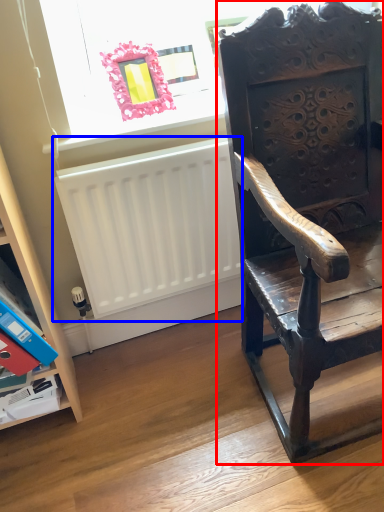
Question: Which object appears closest to the camera in this image, chair (highlighted by a red box) or radiator (highlighted by a blue box)?

Choices:
 (A) chair
 (B) radiator

Answer: (A)